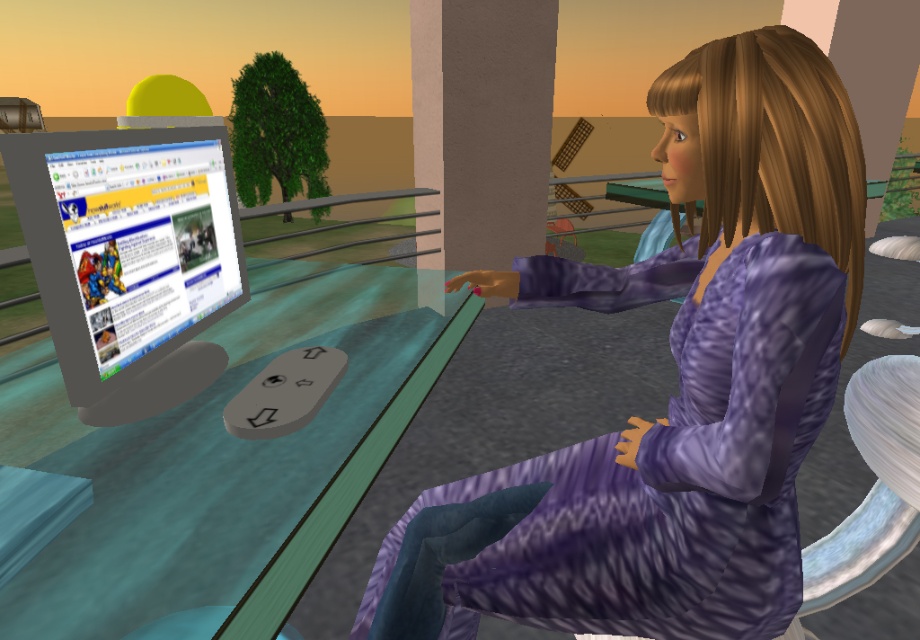
Can you confirm if purple satin dress at center is bigger than matte gray monitor at left?

Correct, purple satin dress at center is larger in size than matte gray monitor at left.

Between point (556, 586) and point (155, 403), which one is positioned behind?

Point (155, 403)

Between point (703, 67) and point (207, 372), which one is positioned in front?

Positioned in front is point (703, 67).

Find the location of a particular element. The image size is (920, 640). purple satin dress at center is located at coordinates (679, 385).